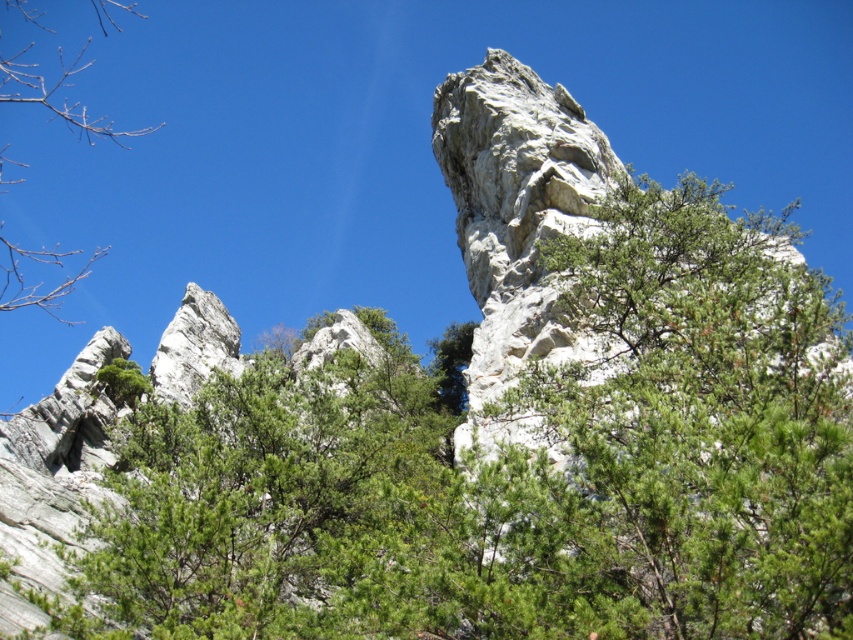
Does point (578, 433) come closer to viewer compared to point (94, 128)?

Yes, it is.

Does green leafy tree at upper center have a smaller size compared to green leafy tree at left?

Actually, green leafy tree at upper center might be larger than green leafy tree at left.

Measure the distance between green leafy tree at upper center and camera.

green leafy tree at upper center is 45.45 meters away from camera.

In order to click on green leafy tree at upper center in this screenshot , I will do `click(511, 467)`.

You are a GUI agent. You are given a task and a screenshot of the screen. Output one action in this format:
    pyautogui.click(x=<x>, y=<y>)
    Task: Click on the green leafy tree at upper right
    The height and width of the screenshot is (640, 853).
    Given the screenshot: What is the action you would take?
    pyautogui.click(x=677, y=438)

Which of these two, green leafy tree at upper right or green leafy tree at left, stands shorter?

green leafy tree at upper right

At what (x,y) coordinates should I click in order to perform the action: click on green leafy tree at upper right. Please return your answer as a coordinate pair (x, y). This screenshot has width=853, height=640. Looking at the image, I should click on (677, 438).

What do you see at coordinates (511, 467) in the screenshot? This screenshot has width=853, height=640. I see `green leafy tree at upper center` at bounding box center [511, 467].

Which of these two, green leafy tree at upper center or green leafy tree at upper right, stands taller?

With more height is green leafy tree at upper center.

Who is more forward, [666,408] or [584,464]?

Point [666,408]

Where is `green leafy tree at upper center`? The image size is (853, 640). green leafy tree at upper center is located at coordinates (511, 467).